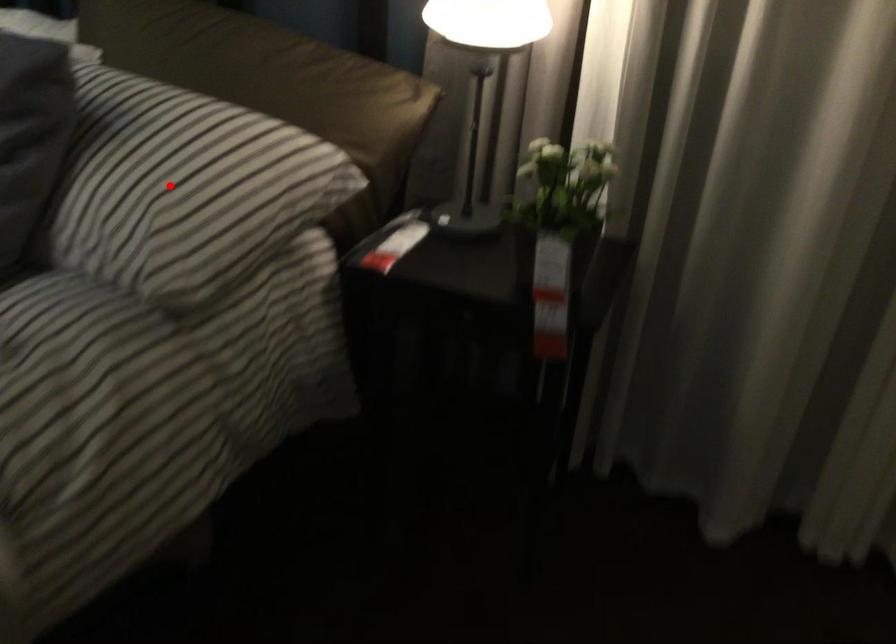
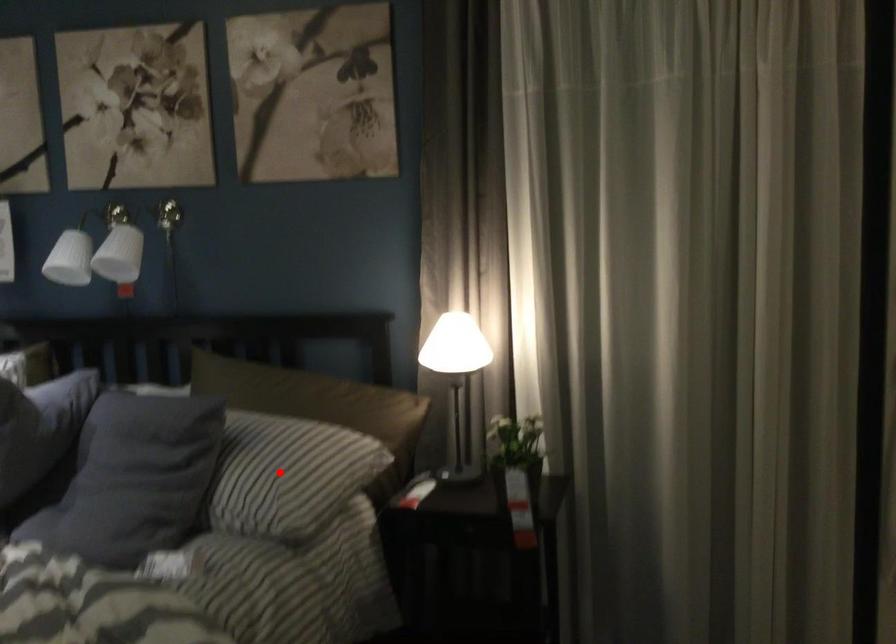
I am providing you with two images of the same scene from different viewpoints. A red point is marked on the first image and another point is marked on the second image. Are the points marked in image1 and image2 representing the same 3D position?

Yes